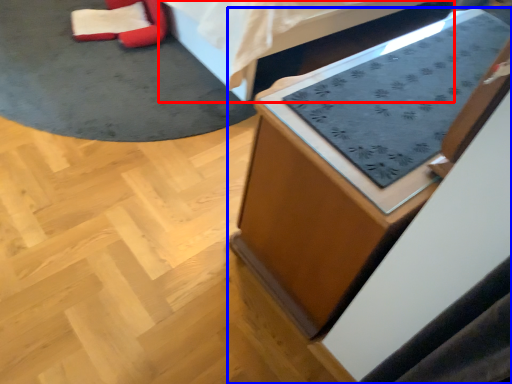
Question: Which of the following is the closest to the observer, furniture (highlighted by a red box) or furniture (highlighted by a blue box)?

Choices:
 (A) furniture
 (B) furniture

Answer: (B)